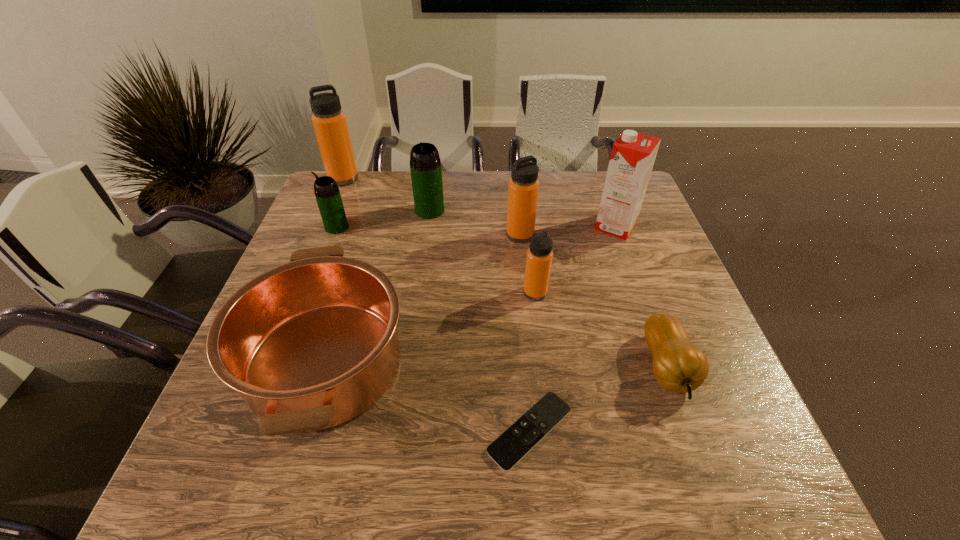
The width and height of the screenshot is (960, 540). I want to click on the biggest orange thermos bottle, so click(x=329, y=121).

Find the location of a particular element. the leftmost orange thermos bottle is located at coordinates pos(329,121).

Where is `carton`? This screenshot has height=540, width=960. carton is located at coordinates (633, 154).

The image size is (960, 540). What are the coordinates of `the farther green thermos bottle` in the screenshot? It's located at (425, 165).

Identify the location of the bigger green thermos bottle. (425, 165).

Find the location of a particular element. The height and width of the screenshot is (540, 960). the second nearest orange thermos bottle is located at coordinates 523,188.

Where is `the left green thermos bottle`? Image resolution: width=960 pixels, height=540 pixels. the left green thermos bottle is located at coordinates pyautogui.click(x=328, y=197).

The height and width of the screenshot is (540, 960). I want to click on the nearer green thermos bottle, so click(328, 197).

This screenshot has height=540, width=960. Identify the location of the nearest thermos bottle. (539, 257).

This screenshot has width=960, height=540. I want to click on the nearest orange thermos bottle, so click(539, 257).